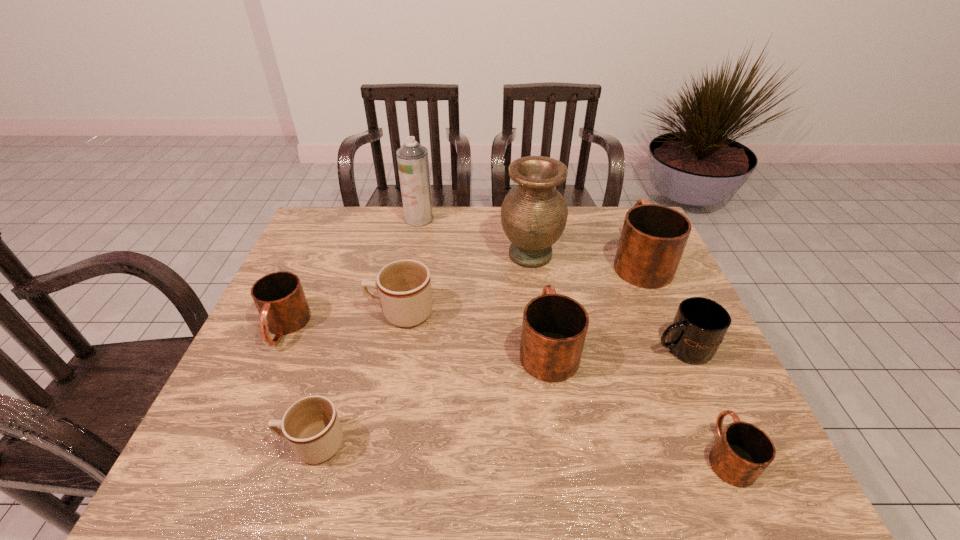
You are a GUI agent. You are given a task and a screenshot of the screen. Output one action in this format:
    pyautogui.click(x=<x>, y=<y>)
    Task: Click on the vacant area located 0.400m on the side of the nearest rust mug with the handle
    
    Given the screenshot: What is the action you would take?
    pyautogui.click(x=659, y=297)

Where is `vacant region located on the side of the nearest rust mug with the handle`? Image resolution: width=960 pixels, height=540 pixels. vacant region located on the side of the nearest rust mug with the handle is located at coordinates (661, 305).

The width and height of the screenshot is (960, 540). In order to click on aerosol can located at the far edge in this screenshot , I will do `click(412, 158)`.

Locate an element on the screen. The height and width of the screenshot is (540, 960). vase that is positioned at the far edge is located at coordinates (533, 215).

This screenshot has width=960, height=540. Find the location of `mug that is at the far edge`. mug that is at the far edge is located at coordinates (653, 238).

The image size is (960, 540). What are the coordinates of `object that is positioned at the left edge` in the screenshot? It's located at (279, 297).

This screenshot has height=540, width=960. Find the location of `object positioned at the far right corner`. object positioned at the far right corner is located at coordinates (653, 238).

Locate an element on the screen. The width and height of the screenshot is (960, 540). object present at the near right corner is located at coordinates (743, 451).

At what (x,y) coordinates should I click in order to perform the action: click on blank space at the far edge of the desktop. Please return your answer as a coordinate pair (x, y). The image size is (960, 540). Looking at the image, I should click on (461, 243).

Where is `vacant space at the near edge of the desktop`? This screenshot has height=540, width=960. vacant space at the near edge of the desktop is located at coordinates (285, 487).